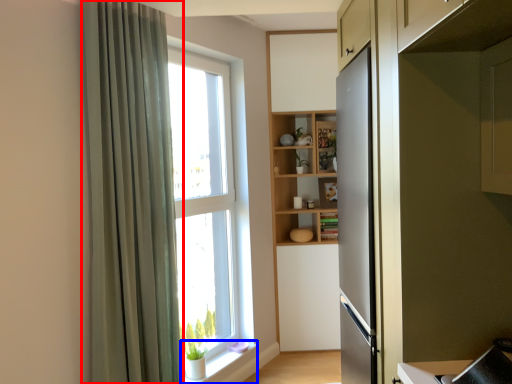
Question: Among these objects, which one is farthest to the camera, curtain (highlighted by a red box) or window sill (highlighted by a blue box)?

Choices:
 (A) curtain
 (B) window sill

Answer: (B)